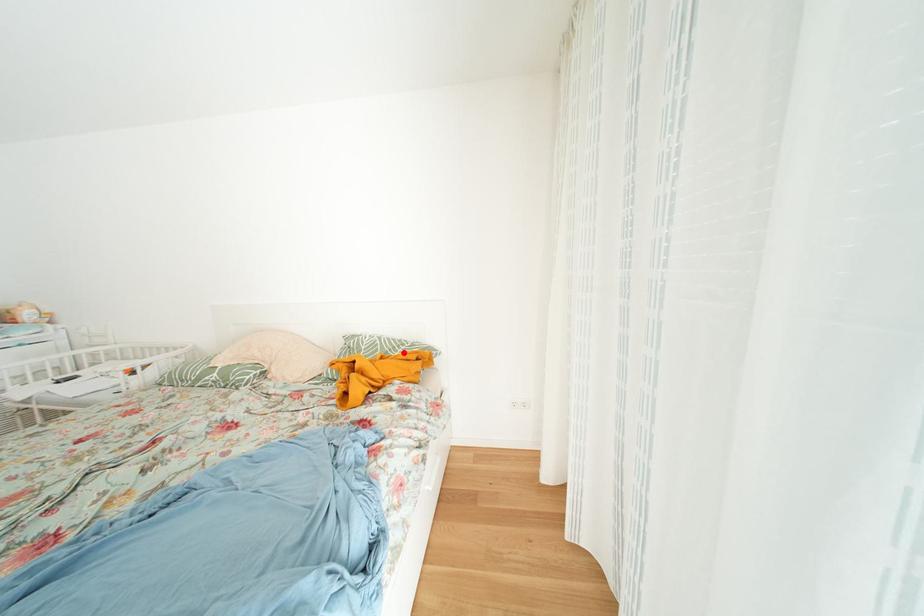
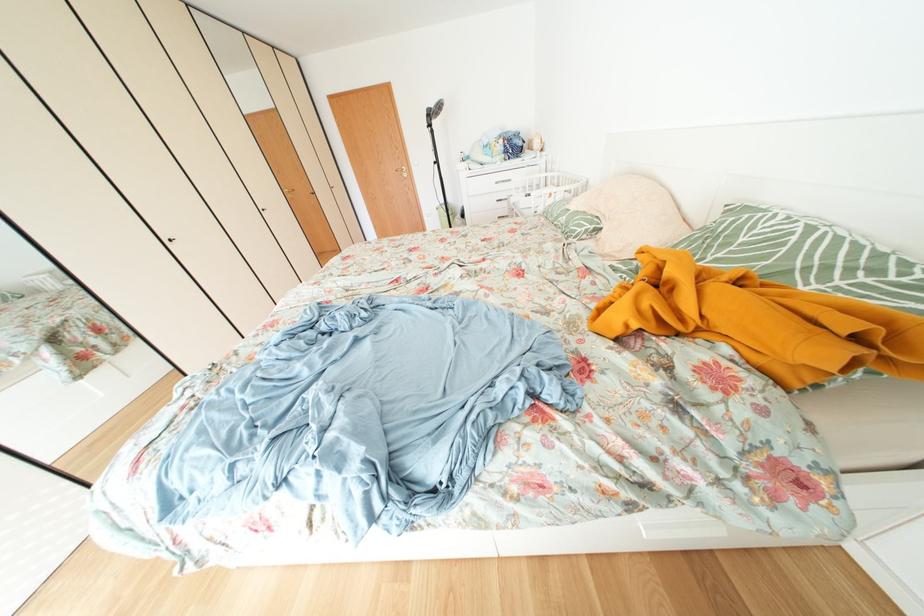
Locate, in the second image, the point that corresponds to the highlighted location in the first image.

(837, 273)